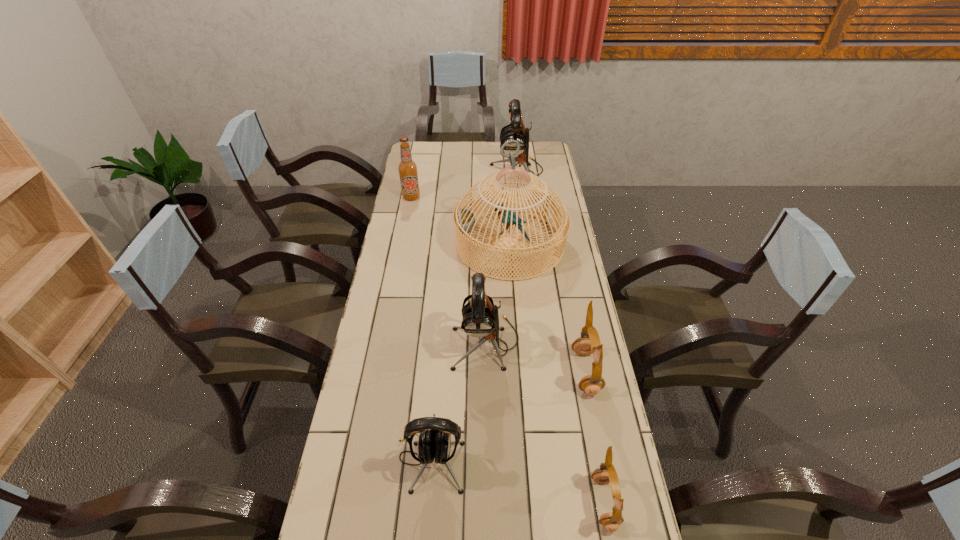
Find the location of a particular element. This screenshot has width=960, height=540. blank space located on the front-facing side of the shortest object is located at coordinates (556, 502).

This screenshot has width=960, height=540. Identify the location of free space located 0.230m on the front-facing side of the shortest object. (498, 502).

This screenshot has height=540, width=960. I want to click on vacant point located on the front-facing side of the shortest object, so click(x=527, y=502).

In order to click on object that is at the far edge in this screenshot , I will do `click(515, 130)`.

At what (x,y) coordinates should I click in order to perform the action: click on beer bottle that is positioned at the left edge. Please return your answer as a coordinate pair (x, y). This screenshot has width=960, height=540. Looking at the image, I should click on (407, 168).

Find the location of a particular element. earphone present at the left edge is located at coordinates (435, 443).

Locate an element on the screen. birdcage that is positioned at the right edge is located at coordinates (464, 220).

Identify the location of object present at the far right corner. The width and height of the screenshot is (960, 540). (515, 130).

Locate an element on the screen. free space at the far edge of the desktop is located at coordinates (492, 147).

At what (x,y) coordinates should I click in order to perform the action: click on free space at the left edge of the desktop. Please return your answer as a coordinate pair (x, y). Image resolution: width=960 pixels, height=540 pixels. Looking at the image, I should click on (421, 213).